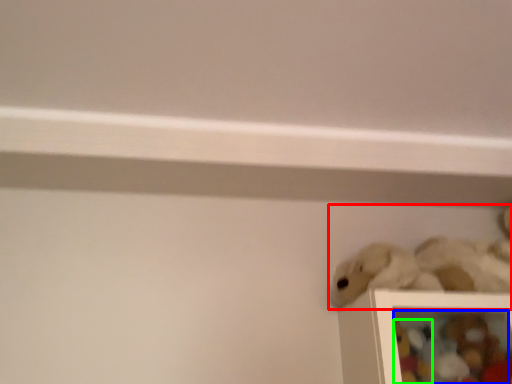
Question: Based on their relative distances, which object is nearer to toy (highlighted by a red box)? Choose from toy (highlighted by a blue box) and toy (highlighted by a green box).

Choices:
 (A) toy
 (B) toy

Answer: (A)